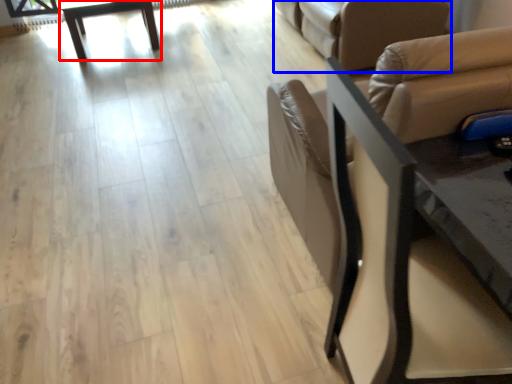
Question: Which object is closer to the camera taking this photo, table (highlighted by a red box) or futon (highlighted by a blue box)?

Choices:
 (A) table
 (B) futon

Answer: (B)